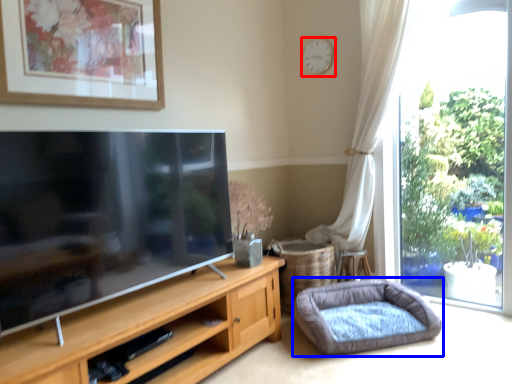
Question: Which object appears closest to the camera in this image, clock (highlighted by a red box) or dog bed (highlighted by a blue box)?

Choices:
 (A) clock
 (B) dog bed

Answer: (B)